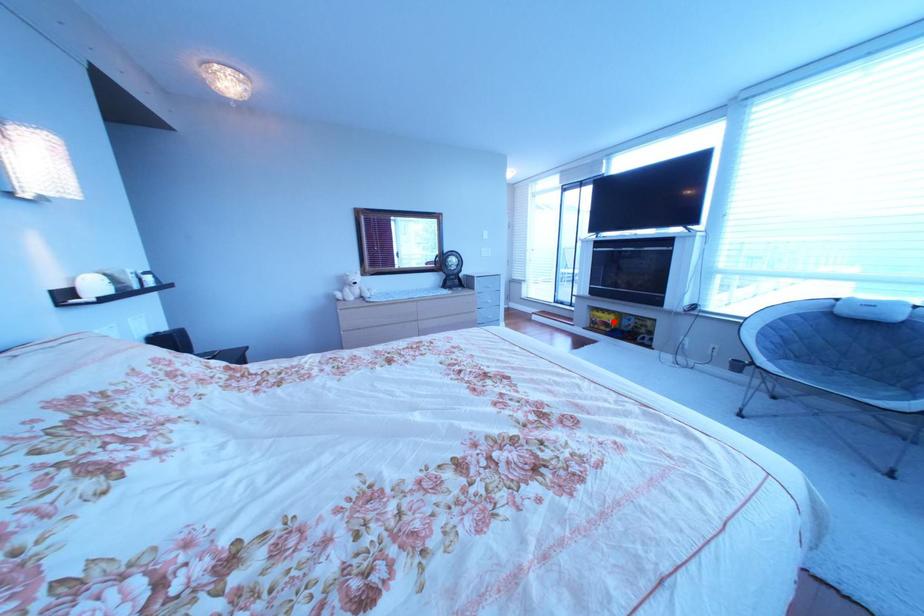
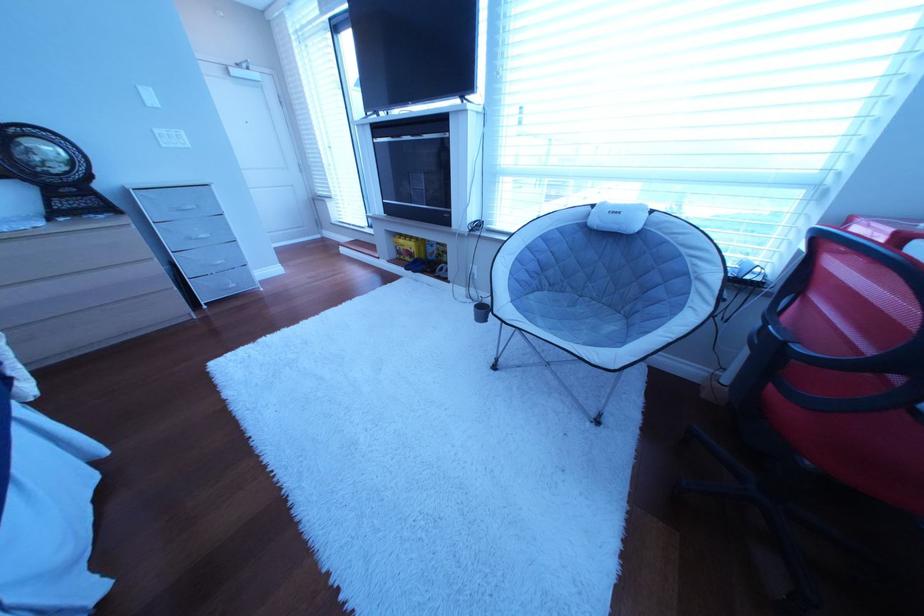
In the second image, find the point that corresponds to the highlighted location in the first image.

(418, 251)